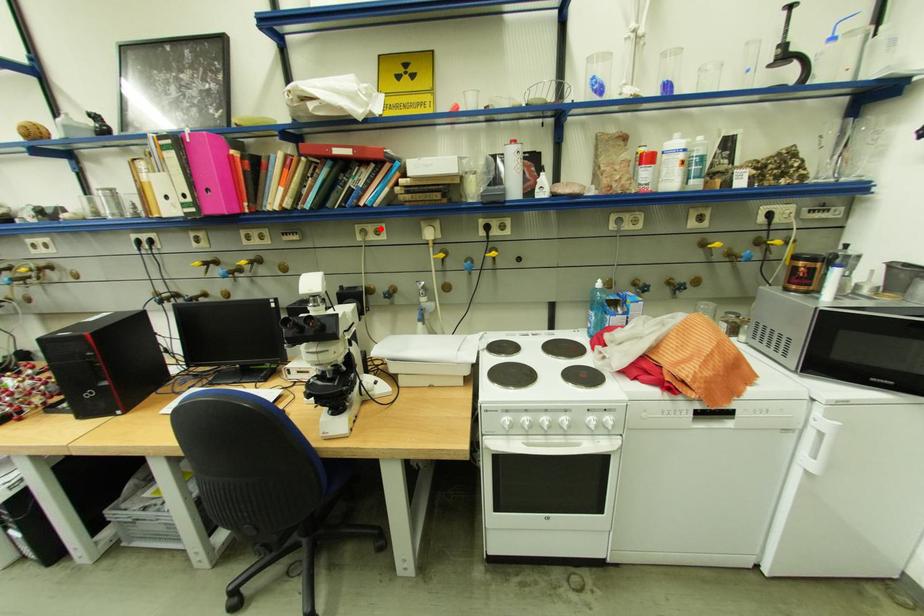
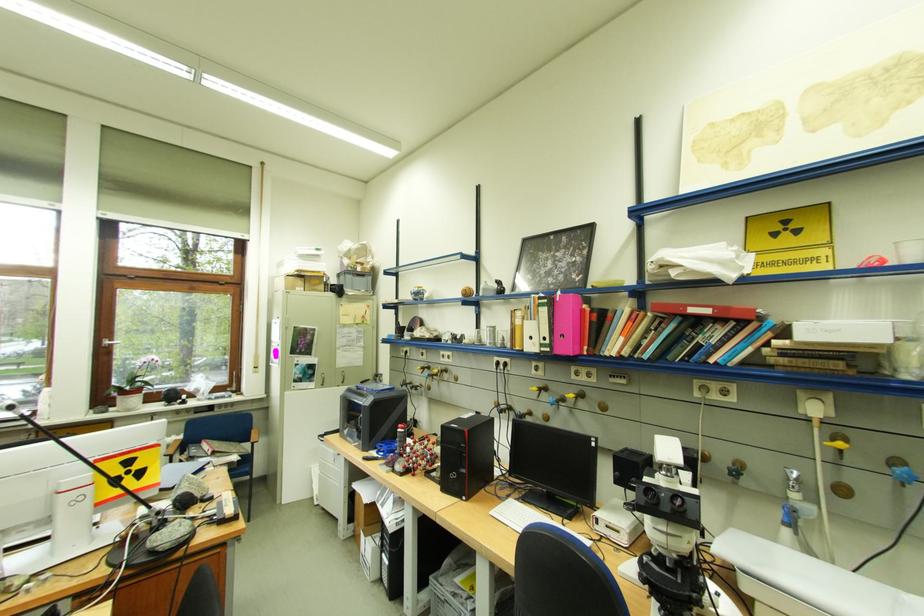
Question: I am providing you with two images of the same scene from different viewpoints. A red point is marked on the first image. At the location where the point appears in image 1, is it still visible in image 2?

Choices:
 (A) Yes
 (B) No

Answer: (A)